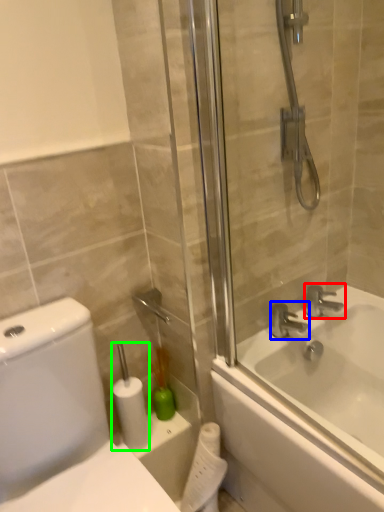
Question: Which object is positioned closest to tap (highlighted by a red box)? Select from tap (highlighted by a blue box) and toilet paper (highlighted by a green box).

Choices:
 (A) tap
 (B) toilet paper

Answer: (A)